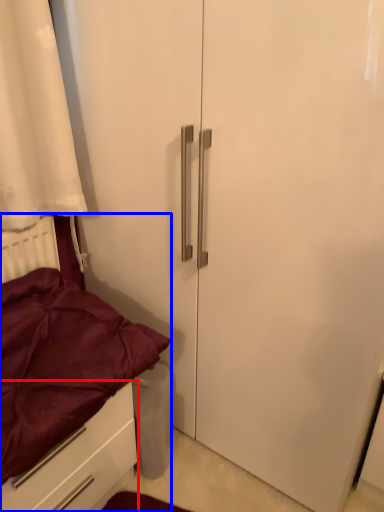
Question: Which object is further to the camera taking this photo, drawer (highlighted by a red box) or bed (highlighted by a blue box)?

Choices:
 (A) drawer
 (B) bed

Answer: (A)